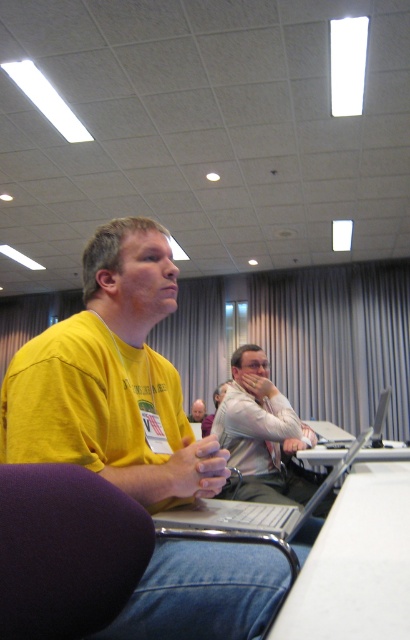
Is point (170, 465) positioned behind point (141, 525)?

Yes, point (170, 465) is farther from viewer.

This screenshot has width=410, height=640. What do you see at coordinates (111, 380) in the screenshot?
I see `yellow t-shirt at center` at bounding box center [111, 380].

Does point (161, 548) lie behind point (129, 525)?

That is True.

The width and height of the screenshot is (410, 640). Identify the location of yellow t-shirt at center. (111, 380).

Does point (88, 600) come in front of point (198, 417)?

Yes.

Is purple fabric chair at lower left thinner than light brown hair at center?

Correct, purple fabric chair at lower left's width is less than light brown hair at center's.

Locate an element on the screen. The image size is (410, 640). purple fabric chair at lower left is located at coordinates (66, 550).

From the picture: Between yellow t-shirt at center and silver metallic laptop at center, which one is positioned lower?

Positioned lower is silver metallic laptop at center.

Who is positioned more to the left, yellow t-shirt at center or silver metallic laptop at center?

yellow t-shirt at center

Image resolution: width=410 pixels, height=640 pixels. I want to click on yellow t-shirt at center, so click(111, 380).

Where is `yellow t-shirt at center`? yellow t-shirt at center is located at coordinates (111, 380).